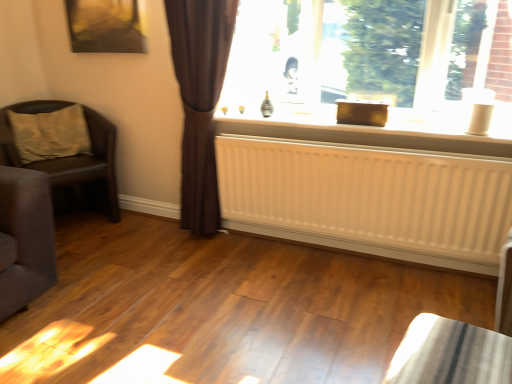
Question: Considering the relative sizes of brown sheer curtain at left and white plastic window sill at center in the image provided, is brown sheer curtain at left shorter than white plastic window sill at center?

Choices:
 (A) no
 (B) yes

Answer: (A)

Question: Does brown sheer curtain at left have a smaller size compared to white plastic window sill at center?

Choices:
 (A) yes
 (B) no

Answer: (B)

Question: From a real-world perspective, is brown sheer curtain at left positioned under white plastic window sill at center based on gravity?

Choices:
 (A) no
 (B) yes

Answer: (B)

Question: Is brown sheer curtain at left bigger than white plastic window sill at center?

Choices:
 (A) no
 (B) yes

Answer: (B)

Question: Considering the relative sizes of brown sheer curtain at left and white plastic window sill at center in the image provided, is brown sheer curtain at left thinner than white plastic window sill at center?

Choices:
 (A) yes
 (B) no

Answer: (A)

Question: Is brown sheer curtain at left located outside white plastic window sill at center?

Choices:
 (A) yes
 (B) no

Answer: (A)

Question: From the image's perspective, is brown sheer curtain at left located beneath beige fabric pillow at left?

Choices:
 (A) no
 (B) yes

Answer: (B)

Question: Would you say beige fabric pillow at left is part of brown sheer curtain at left's contents?

Choices:
 (A) no
 (B) yes

Answer: (A)

Question: Is brown sheer curtain at left taller than beige fabric pillow at left?

Choices:
 (A) no
 (B) yes

Answer: (B)

Question: Is brown sheer curtain at left at the right side of beige fabric pillow at left?

Choices:
 (A) yes
 (B) no

Answer: (A)

Question: Considering the relative sizes of brown sheer curtain at left and beige fabric pillow at left in the image provided, is brown sheer curtain at left thinner than beige fabric pillow at left?

Choices:
 (A) yes
 (B) no

Answer: (A)

Question: Could you tell me if brown sheer curtain at left is turned towards beige fabric pillow at left?

Choices:
 (A) yes
 (B) no

Answer: (B)

Question: Is metallic gold picture frame at upper left bigger than shiny metallic table at lower right?

Choices:
 (A) no
 (B) yes

Answer: (A)